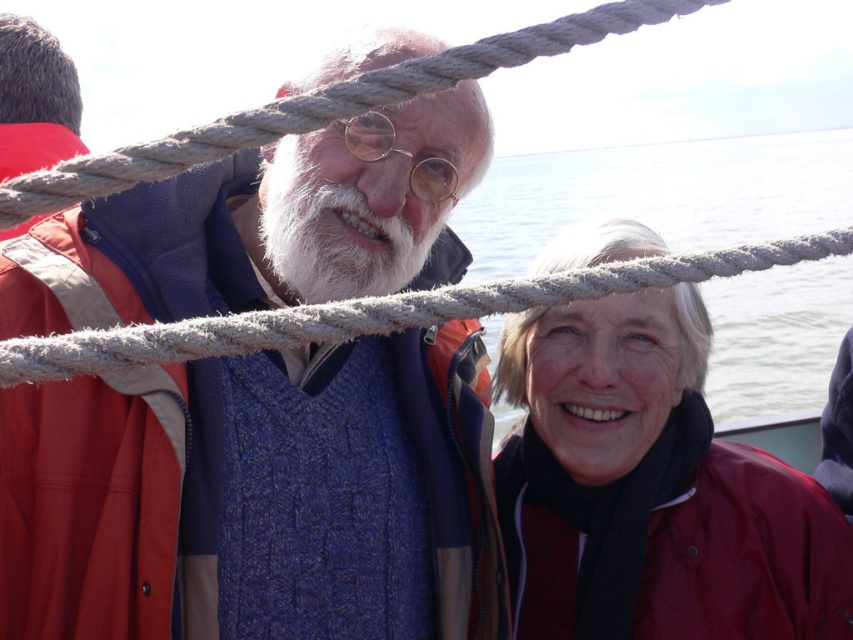
You are a photographer on a boat and need to decide where to place a new camera bag. The blue knitted sweater at center and the matte red jacket at right are already on the boat. Since the camera bag is 10 cm thick, can it fit between them if the space between them is determined by their thickness?

→ The blue knitted sweater at center is thinner than the matte red jacket at right. However, the exact thickness of each item isn not provided, so it is impossible to determine if the 10 cm thick camera bag can fit between them based on the given information.

You are a photographer on a boat and want to capture a wide shot of the clear water at upper center and the burgundy fabric life jacket at lower right. Given that your camera can only focus on one object at a time, which object should you focus on to ensure it fills more of the frame?

The clear water at upper center is bigger than the burgundy fabric life jacket at lower right, so focusing on the clear water at upper center will ensure it fills more of the frame.